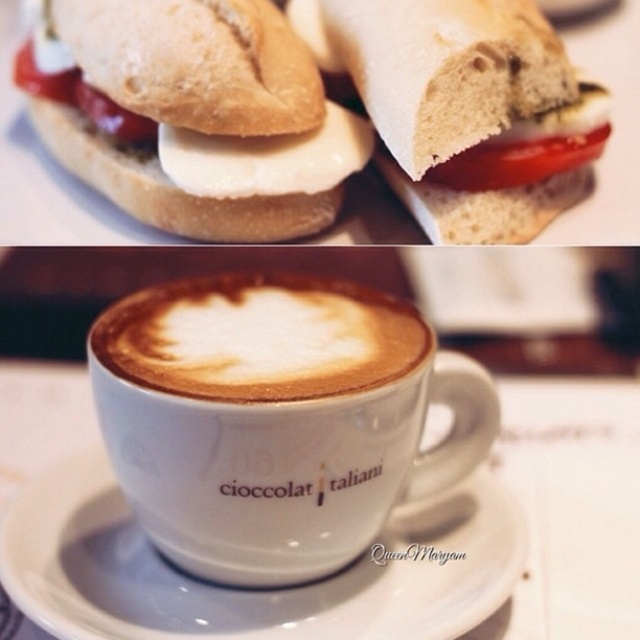
You are a barista preparing a drink. You have a white frothy coffee at center and a red glossy tomato at center on the counter. You need to place both items on a small tray that can only hold one item at a time. Which item should you choose to fit on the tray first based on their sizes?

The white frothy coffee at center has a larger width than the red glossy tomato at center, so you should place the white frothy coffee at center first to ensure it fits on the tray.

You are a food delivery person who needs to place a small container between the white soft bread at upper left and the red tomato slice at lower right. Can you fit it there?

The distance between the white soft bread at upper left and the red tomato slice at lower right is 3.76 feet, so yes, the small container can be placed between them as there is enough space.

You are looking at the top section of the image which shows a sandwich. There is a point marked at coordinates (205, 116). What object is located at this point?

The point at coordinates (205, 116) indicates white soft bread at upper left.